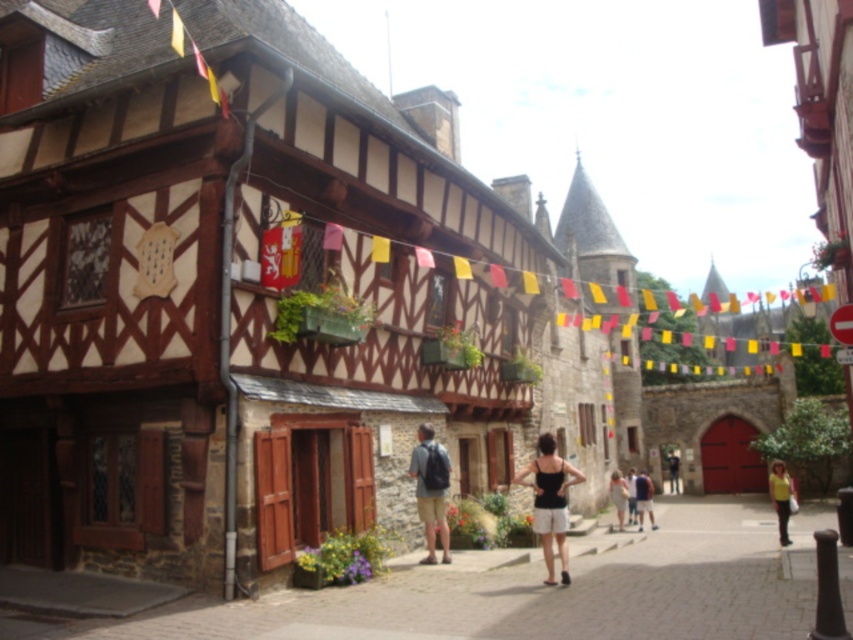
Measure the distance from light brown leather shoes at center to yellow matte shirt at lower right.

They are 16.37 meters apart.

Find the location of a particular element. Image resolution: width=853 pixels, height=640 pixels. light brown leather shoes at center is located at coordinates click(633, 497).

Between stone paved alley at center and yellow matte shirt at lower right, which one has more height?

Standing taller between the two is yellow matte shirt at lower right.

The height and width of the screenshot is (640, 853). What do you see at coordinates (535, 593) in the screenshot?
I see `stone paved alley at center` at bounding box center [535, 593].

What are the coordinates of `stone paved alley at center` in the screenshot? It's located at (535, 593).

You are a GUI agent. You are given a task and a screenshot of the screen. Output one action in this format:
    pyautogui.click(x=<x>, y=<y>)
    Task: Click on the stone paved alley at center
    Image resolution: width=853 pixels, height=640 pixels.
    Given the screenshot: What is the action you would take?
    pyautogui.click(x=535, y=593)

Consider the image. Measure the distance between point (425, 490) and camera.

140.68 feet

Between point (425, 483) and point (613, 477), which one is positioned in front?

Point (425, 483) is in front.

Which is in front, point (447, 480) or point (630, 496)?

Point (447, 480) is more forward.

Find the location of a particular element. The width and height of the screenshot is (853, 640). matte black backpack at center is located at coordinates (430, 493).